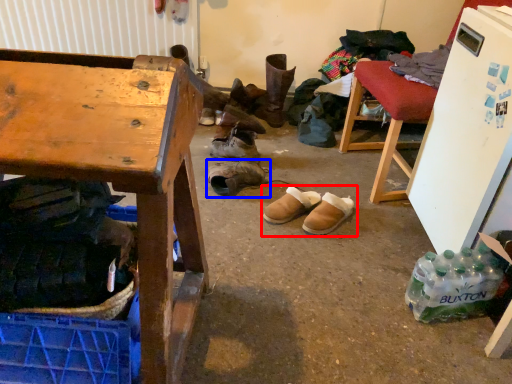
Question: Which point is further to the camera, footwear (highlighted by a red box) or footwear (highlighted by a blue box)?

Choices:
 (A) footwear
 (B) footwear

Answer: (B)